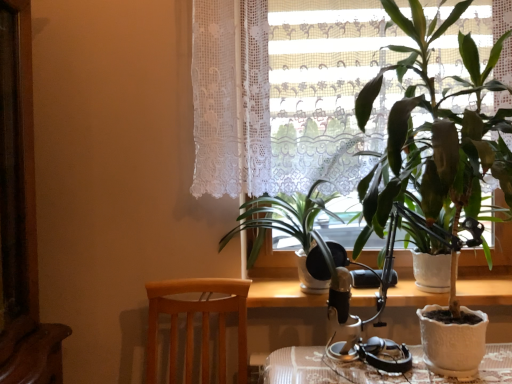
Question: In terms of width, does white lace curtain at upper center look wider or thinner when compared to green glossy plant at center, which is the first houseplant from left to right?

Choices:
 (A) wide
 (B) thin

Answer: (B)

Question: Relative to green glossy plant at center, marked as the second houseplant in a right-to-left arrangement, is white lace curtain at upper center in front or behind?

Choices:
 (A) behind
 (B) front

Answer: (A)

Question: Estimate the real-world distances between objects in this image. Which object is farther from the light brown wood chair at lower left?

Choices:
 (A) green glossy plant at center, marked as the second houseplant in a right-to-left arrangement
 (B) wooden table at center
 (C) white lace curtain at upper center
 (D) green matte houseplant at right, the 1th houseplant positioned from the right

Answer: (D)

Question: Which is farther from the white lace curtain at upper center?

Choices:
 (A) green matte houseplant at right, acting as the second houseplant starting from the left
 (B) wooden table at center
 (C) green glossy plant at center, which is the first houseplant from left to right
 (D) light brown wood chair at lower left

Answer: (B)